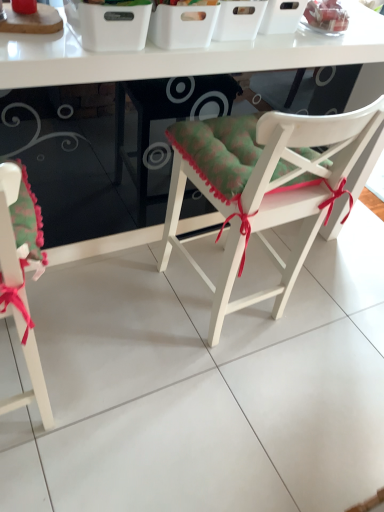
Locate an element on the screen. The image size is (384, 512). free space between white wood chair at center, arranged as the 1th chair when viewed from the right, and matte green cushion at lower left, acting as the 2th chair starting from the right is located at coordinates (x=112, y=343).